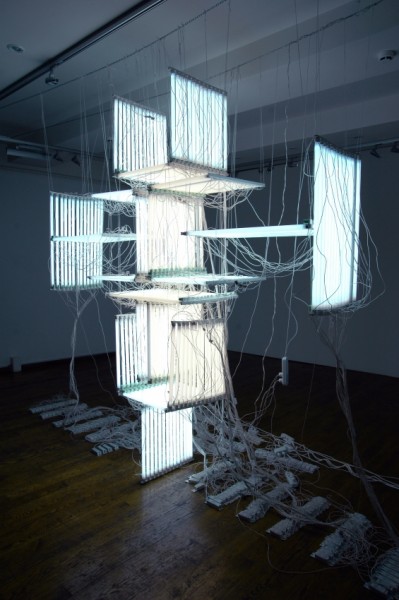
Find the location of a particular element. power strip is located at coordinates (283, 367).